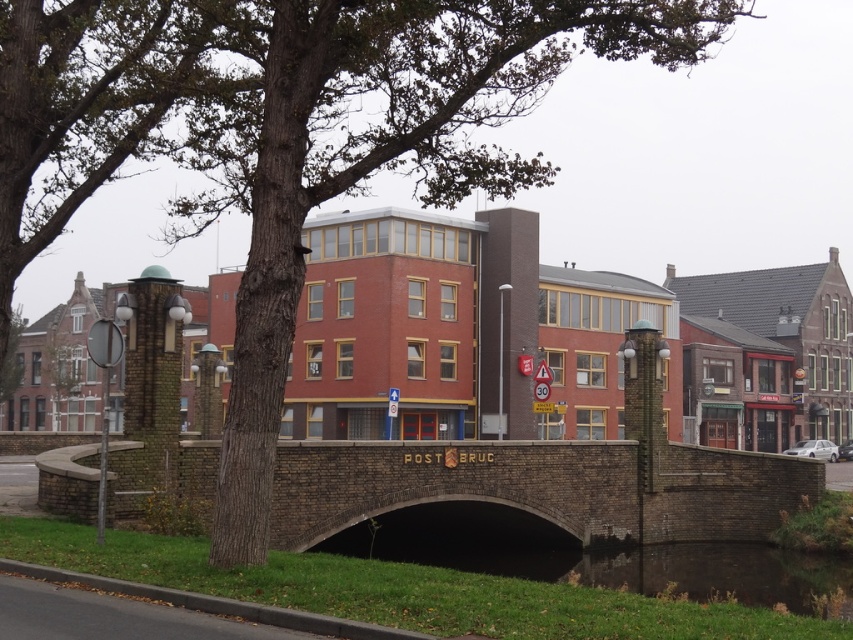
Question: Which point is closer to the camera?

Choices:
 (A) brown stone bridge at center
 (B) dark green grass at lower center

Answer: (A)

Question: Does brown stone bridge at center appear on the left side of dark green grass at lower center?

Choices:
 (A) yes
 (B) no

Answer: (A)

Question: Which of the following is the farthest from the observer?

Choices:
 (A) brown stone bridge at center
 (B) dark green grass at lower center

Answer: (B)

Question: Does brown stone bridge at center appear on the right side of dark green grass at lower center?

Choices:
 (A) yes
 (B) no

Answer: (B)

Question: Does brown stone bridge at center appear on the right side of dark green grass at lower center?

Choices:
 (A) yes
 (B) no

Answer: (B)